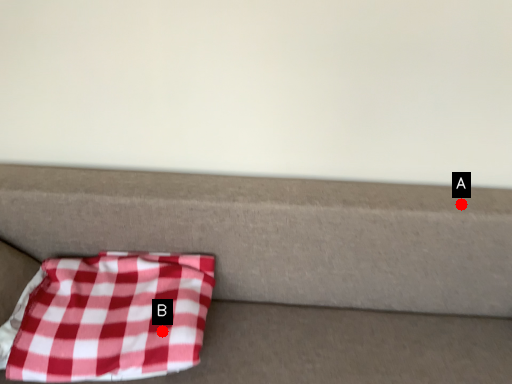
Question: Two points are circled on the image, labeled by A and B beside each circle. Which point is farther to the camera?

Choices:
 (A) A is further
 (B) B is further

Answer: (A)